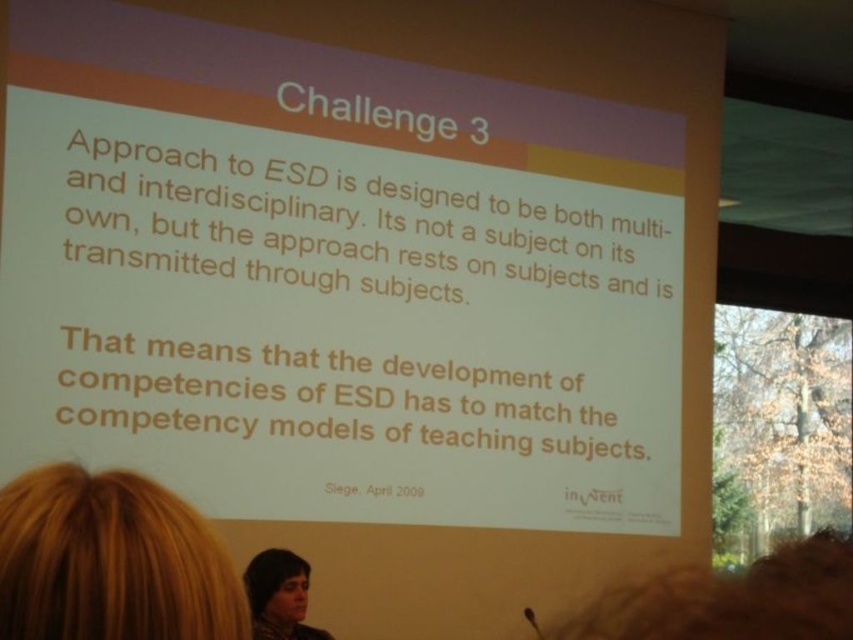
You are a photographer standing 1.5 meters away from the screen. You want to take a photo of the slide titled Challenge 3 while ensuring that the blonde hair at lower left is not in the frame. Can you move closer to the screen to achieve this?

The distance of blonde hair at lower left from viewer is 1.43 meters. Since you are currently 1.5 meters away, moving closer to 1.43 meters or less would position you closer than the hair, potentially allowing the hair to be out of the frame if it is between you and the screen. However, practically, moving closer might require adjusting your position to ensure the hair is not obstructing the view. Alternatively, moving slightly sideways could also help avoid the hair while maintaining a clear shot of the

You are an attendee at the conference and you see the slide titled Challenge 3. You notice two people in the audience with different hair colors. Which person has a narrower hair width between the blonde hair at lower left and dark brown hair at lower center?

The blonde hair at lower left has a lesser width compared to dark brown hair at lower center, so the person with blonde hair at lower left has a narrower hair width.